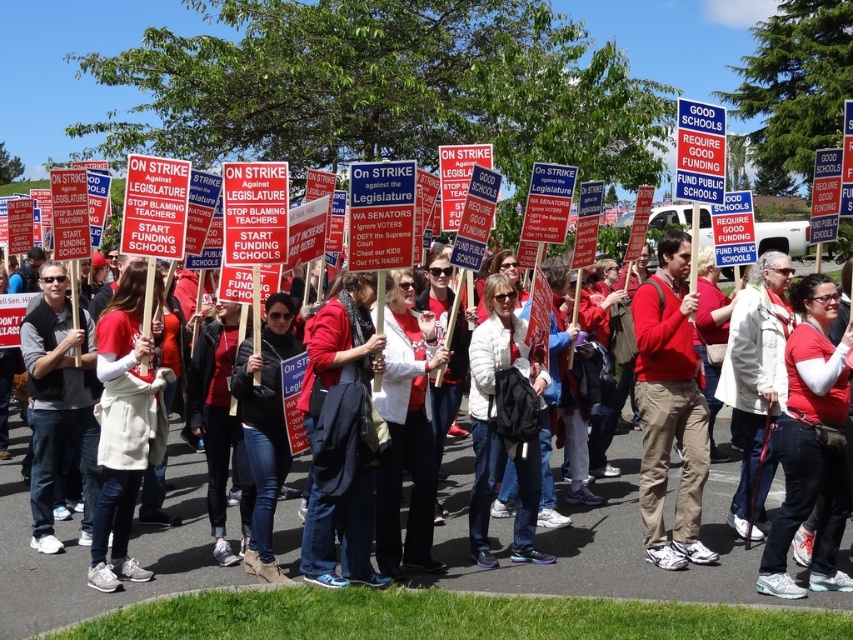
You are a photographer trying to capture a clear photo of the matte red jacket at center and the white matte jacket at center. Which jacket should you focus on to ensure the other remains in the background?

You should focus on the matte red jacket at center because it is in front of the white matte jacket at center, so if you focus on the red jacket, the white one will naturally be in the background.

You are standing at the point marked as point (305, 560). There is a sign that says

The distance between you and the sign is 5.92 meters.